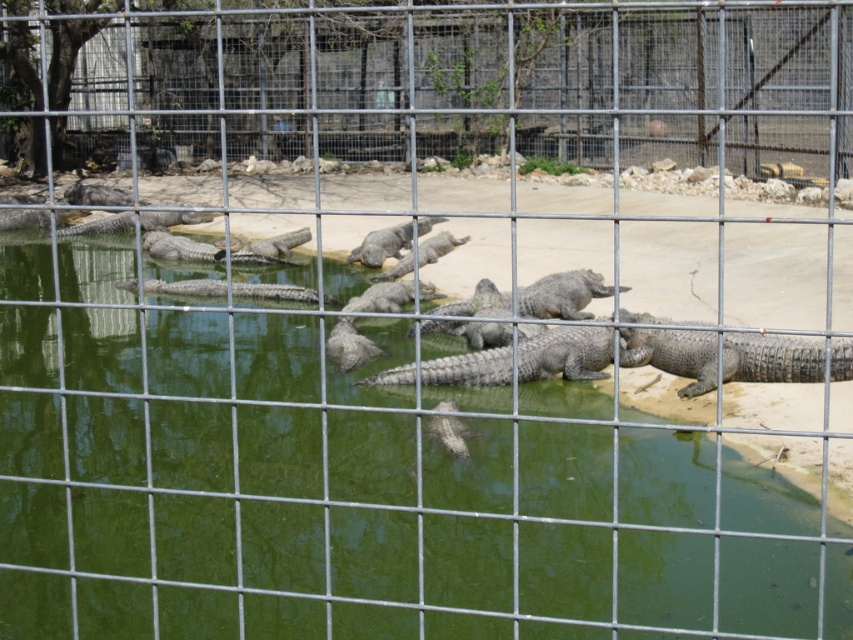
Question: Where is gray textured crocodile at right located in relation to gray matte crocodile at center in the image?

Choices:
 (A) above
 (B) below

Answer: (B)

Question: Is the position of gray textured crocodile at right more distant than that of gray scaly crocodile at center?

Choices:
 (A) no
 (B) yes

Answer: (A)

Question: Which point is closer to the camera?

Choices:
 (A) (427, 216)
 (B) (537, 365)

Answer: (A)

Question: Among these objects, which one is farthest from the camera?

Choices:
 (A) gray textured crocodile at center
 (B) gray textured crocodile at right
 (C) metal wire fence at center

Answer: (A)

Question: Does green murky water at center appear on the right side of gray textured crocodile at right?

Choices:
 (A) yes
 (B) no

Answer: (B)

Question: Which point is farther to the camera?

Choices:
 (A) (546, 340)
 (B) (184, 76)
 (C) (267, 566)

Answer: (B)